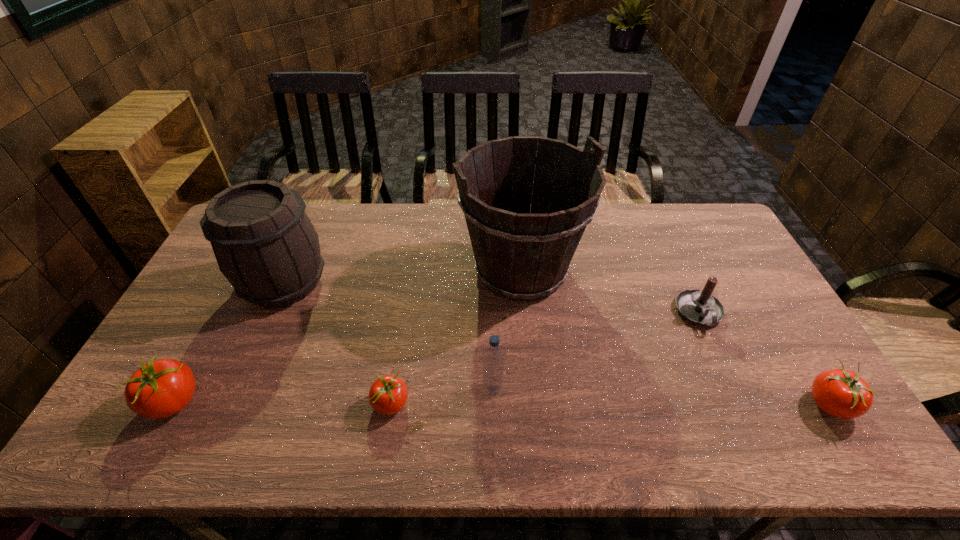
The width and height of the screenshot is (960, 540). Find the location of `the tallest tomato`. the tallest tomato is located at coordinates pyautogui.click(x=159, y=389).

I want to click on the second tomato from right to left, so click(388, 395).

Where is `the shortest tomato`? This screenshot has height=540, width=960. the shortest tomato is located at coordinates (388, 395).

Find the location of a particular element. This screenshot has height=540, width=960. the second tallest tomato is located at coordinates (841, 393).

Locate an element on the screen. This screenshot has height=540, width=960. the rightmost object is located at coordinates (841, 393).

You are a GUI agent. You are given a task and a screenshot of the screen. Output one action in this format:
    pyautogui.click(x=<x>, y=<y>)
    Task: Click on the bucket
    
    Given the screenshot: What is the action you would take?
    pyautogui.click(x=520, y=253)

Locate an element on the screen. The height and width of the screenshot is (540, 960). the second tallest object is located at coordinates (266, 246).

Identify the location of candle. This screenshot has width=960, height=540. (700, 307).

Where is `the fifth shortest object`? the fifth shortest object is located at coordinates 493,358.

What are the coordinates of `free location located on the back of the tallest tomato` in the screenshot? It's located at (232, 293).